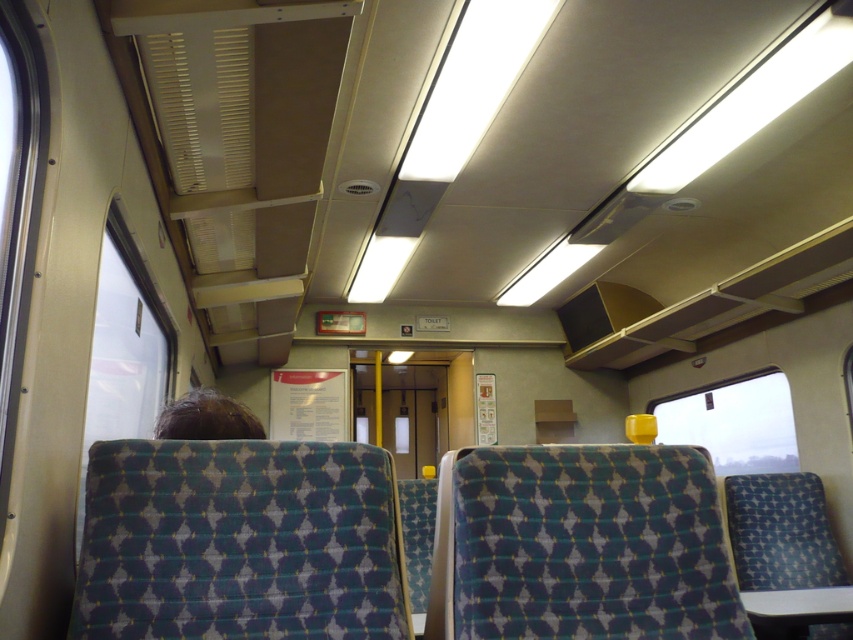
You are sitting in the train carriage and want to look outside. Which object, the transparent glass window at left or the transparent yellow cup at right, should you look through to see the overcast sky and blurred landscape?

The transparent glass window at left is positioned on the left side of transparent yellow cup at right, so you should look through the transparent glass window at left to see the overcast sky and blurred landscape outside.

You are standing at the center of the train carriage and want to look outside through the nearest window. Which direction should you turn to face the transparent glass window at left located at point (x=125, y=349)?

You should turn to your left to face the transparent glass window at left located at point (x=125, y=349) because it is positioned to the left side of the train carriage.